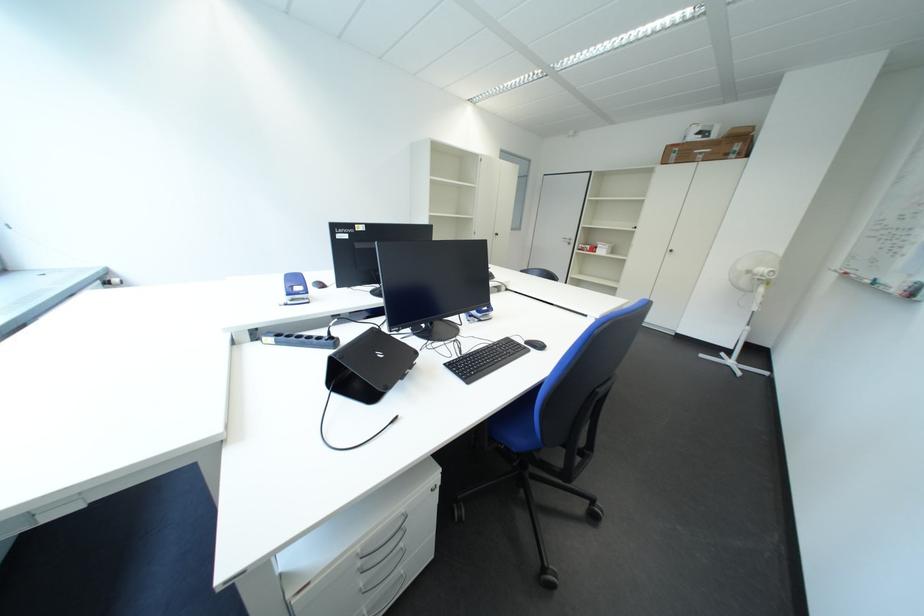
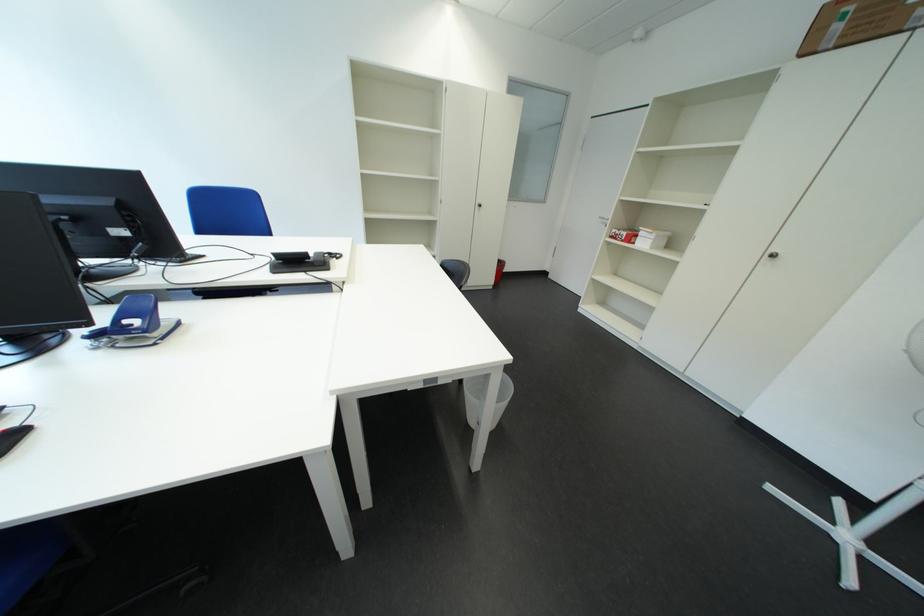
Locate, in the second image, the point that corresponds to the point at 614,254 in the first image.

(657, 246)